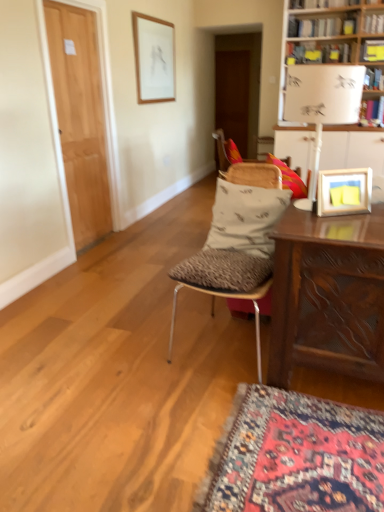
Question: From the image's perspective, is yellow paper at upper right, which ranks as the 1th book in bottom-to-top order, positioned above or below patterned fabric pillow at center?

Choices:
 (A) below
 (B) above

Answer: (B)

Question: Is yellow paper at upper right, arranged as the third book when viewed from the top, spatially inside patterned fabric pillow at center, or outside of it?

Choices:
 (A) outside
 (B) inside

Answer: (A)

Question: Which is farther from the white wooden table at upper right?

Choices:
 (A) light brown wood door at left, the 1th door viewed from the front
 (B) white paper lampshade at upper right
 (C) metallic silver chair at center, which ranks as the second chair in back-to-front order
 (D) white cardboard bookcase at upper right
 (E) matte white picture frame at upper center, the first picture frame positioned from the back

Answer: (E)

Question: Which is nearer to the white wooden table at upper right?

Choices:
 (A) white paper lampshade at upper right
 (B) light brown wood door at left, the second door positioned from the top
 (C) patterned fabric pillow at center
 (D) matte white picture frame at upper center, the 1th picture frame when ordered from top to bottom
 (E) wooden picture frame at upper right, which is counted as the second picture frame, starting from the left

Answer: (E)